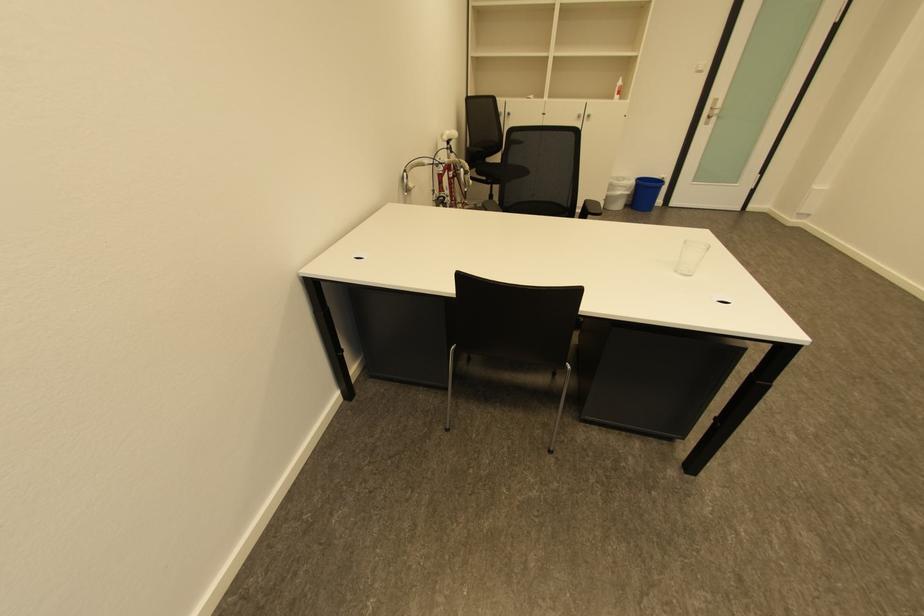
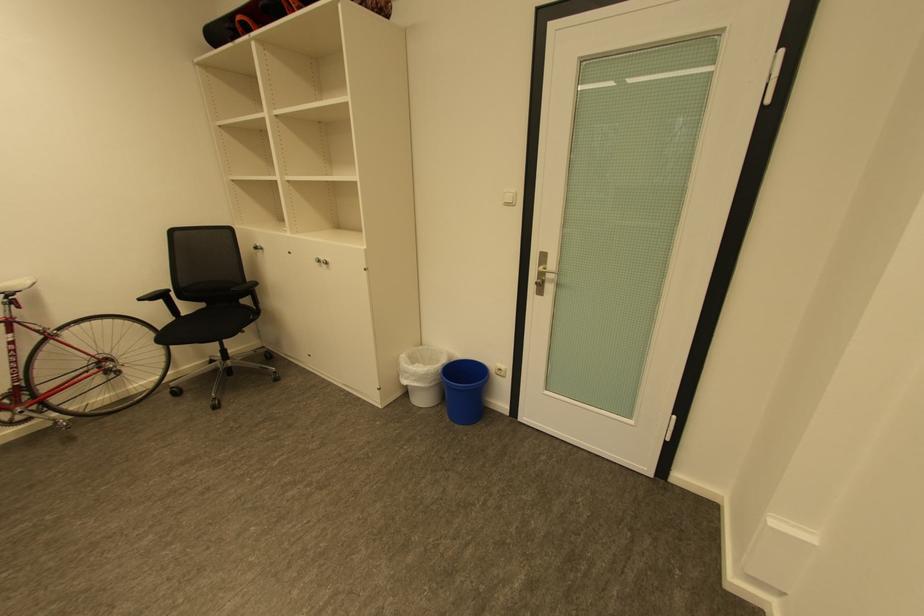
Where in the second image is the point corresponding to (x=516, y=114) from the first image?

(262, 248)